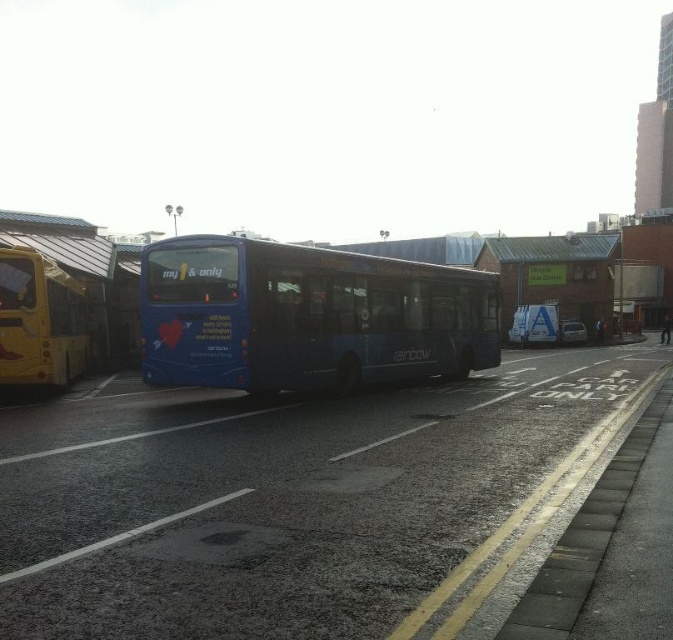
Describe the element at coordinates (306, 316) in the screenshot. I see `blue matte bus at center` at that location.

How far apart are blue matte bus at center and yellow metallic bus at left?

blue matte bus at center and yellow metallic bus at left are 8.29 meters apart.

Is point (472, 269) behind point (15, 339)?

Yes, point (472, 269) is behind point (15, 339).

Where is `blue matte bus at center`? The width and height of the screenshot is (673, 640). blue matte bus at center is located at coordinates (306, 316).